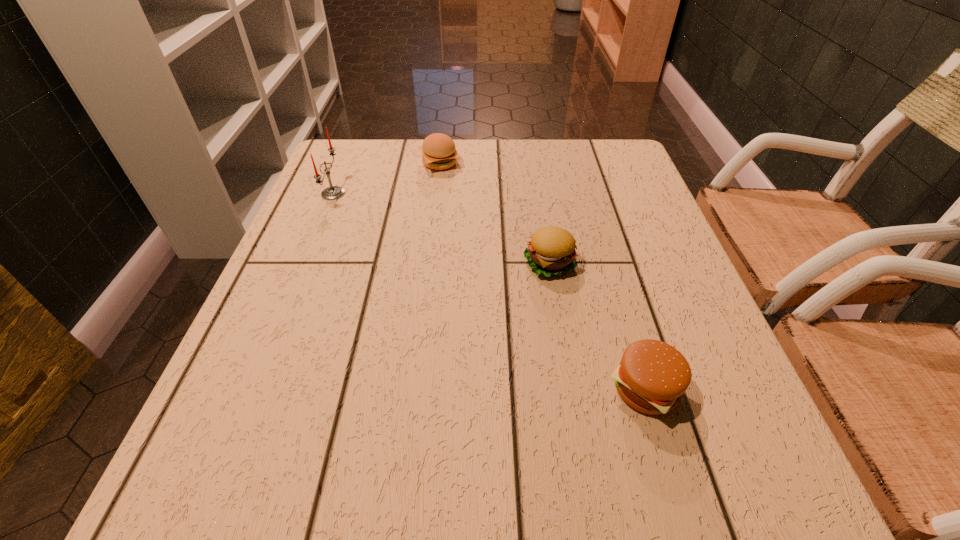
The height and width of the screenshot is (540, 960). In order to click on free region at the right edge of the desktop in this screenshot , I will do click(696, 422).

This screenshot has height=540, width=960. Find the location of `free space at the far left corner of the desktop`. free space at the far left corner of the desktop is located at coordinates (365, 151).

This screenshot has height=540, width=960. In the image, there is a desktop. Identify the location of vacant region at the near left corner. (203, 517).

The width and height of the screenshot is (960, 540). Find the location of `vacant area at the far right corner`. vacant area at the far right corner is located at coordinates (625, 156).

I want to click on unoccupied area between the candle and the nearest hamburger, so click(x=490, y=291).

The height and width of the screenshot is (540, 960). Find the location of `free space between the second hamburger from right to left and the tallest object`. free space between the second hamburger from right to left and the tallest object is located at coordinates (442, 228).

Image resolution: width=960 pixels, height=540 pixels. Find the location of `vacant point located between the second object from left to right and the second nearest object`. vacant point located between the second object from left to right and the second nearest object is located at coordinates (494, 213).

At what (x,y) coordinates should I click in order to perform the action: click on vacant region between the farthest hamburger and the candle. Please return your answer as a coordinate pair (x, y). Looking at the image, I should click on (387, 178).

The image size is (960, 540). What are the coordinates of `free area in between the second farthest hamburger and the candle` in the screenshot? It's located at (442, 228).

Locate an element on the screen. free space between the leftmost object and the third object from left to right is located at coordinates (442, 228).